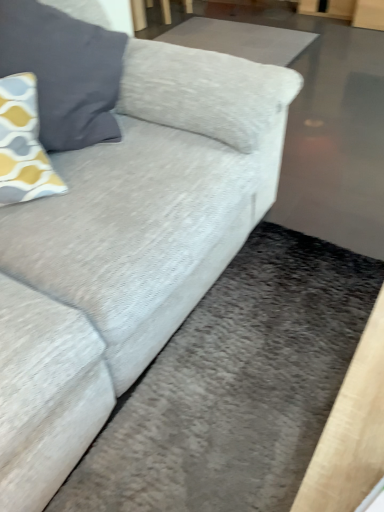
Question: From their relative heights in the image, would you say yellow-gray patterned pillow at upper left is taller or shorter than smooth gray flat at upper center?

Choices:
 (A) short
 (B) tall

Answer: (B)

Question: From the image's perspective, is yellow-gray patterned pillow at upper left positioned above or below smooth gray flat at upper center?

Choices:
 (A) below
 (B) above

Answer: (A)

Question: In the image, is yellow-gray patterned pillow at upper left on the left side or the right side of smooth gray flat at upper center?

Choices:
 (A) left
 (B) right

Answer: (A)

Question: Is smooth gray flat at upper center taller or shorter than yellow-gray patterned pillow at upper left?

Choices:
 (A) tall
 (B) short

Answer: (B)

Question: In terms of width, does smooth gray flat at upper center look wider or thinner when compared to yellow-gray patterned pillow at upper left?

Choices:
 (A) thin
 (B) wide

Answer: (B)

Question: From the image's perspective, relative to yellow-gray patterned pillow at upper left, is smooth gray flat at upper center above or below?

Choices:
 (A) below
 (B) above

Answer: (B)

Question: In the image, is smooth gray flat at upper center on the left side or the right side of yellow-gray patterned pillow at upper left?

Choices:
 (A) right
 (B) left

Answer: (A)